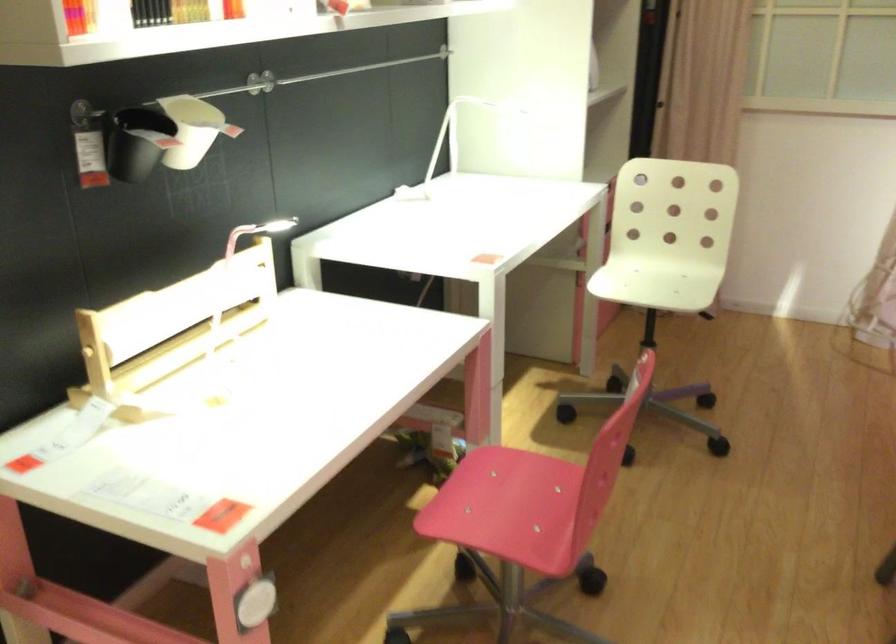
At what (x,y) coordinates should I click in order to perform the action: click on white chair sitting surface. Please return your answer as a coordinate pair (x, y). Image resolution: width=896 pixels, height=644 pixels. Looking at the image, I should click on (668, 277).